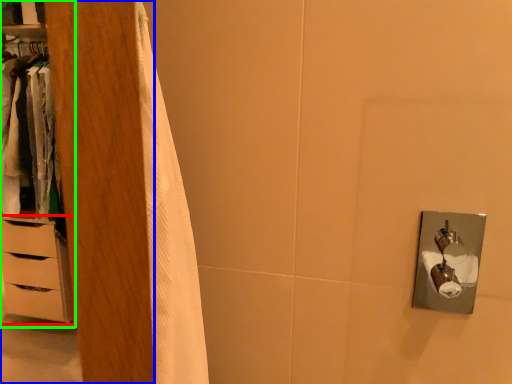
Question: Estimate the real-world distances between objects in this image. Which object is farther from chest of drawers (highlighted by a red box), armoire (highlighted by a blue box) or dresser (highlighted by a green box)?

Choices:
 (A) armoire
 (B) dresser

Answer: (A)